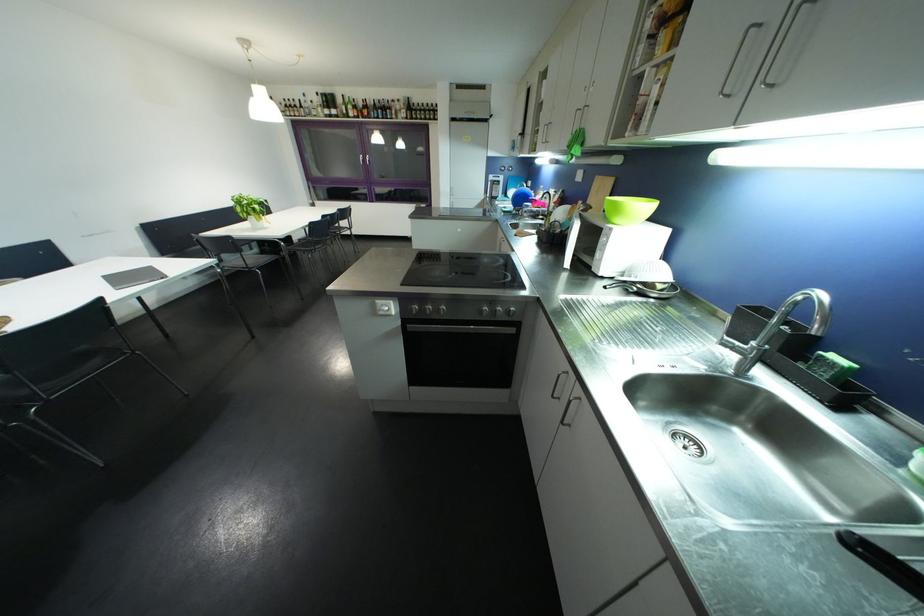
The height and width of the screenshot is (616, 924). What are the coordinates of `black sink caddy` in the screenshot? It's located at (825, 386).